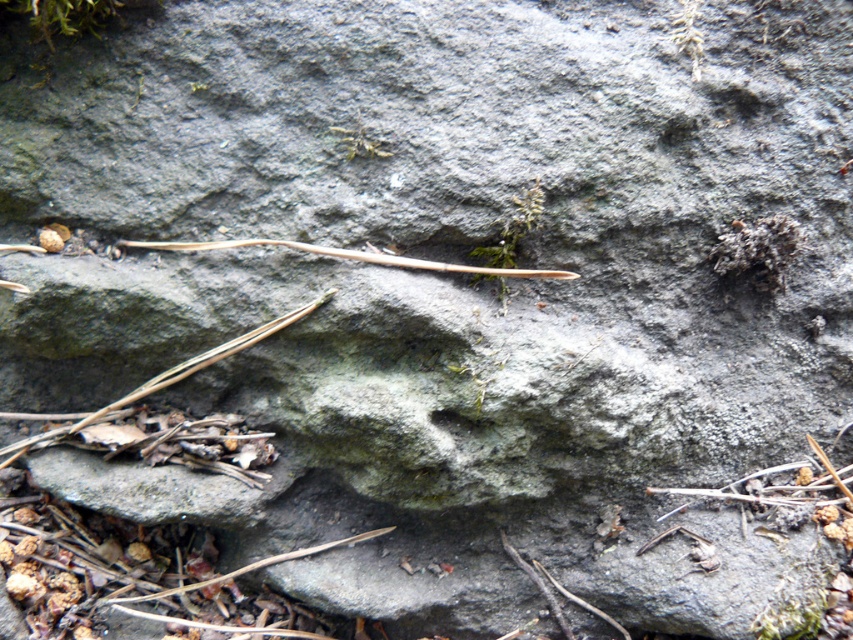
You are a geologist examining the rock surface. You notice a point marked at coordinates (351, 257). What object is located at that exact point?

The brown wood twig at center is located at point (351, 257).